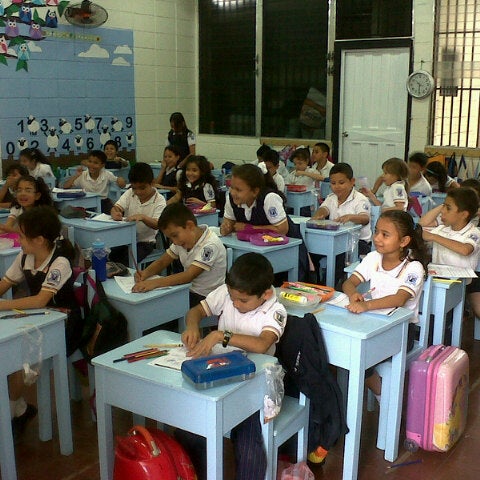
Identify the location of black non see-through windows. (226, 45), (288, 53), (368, 22).